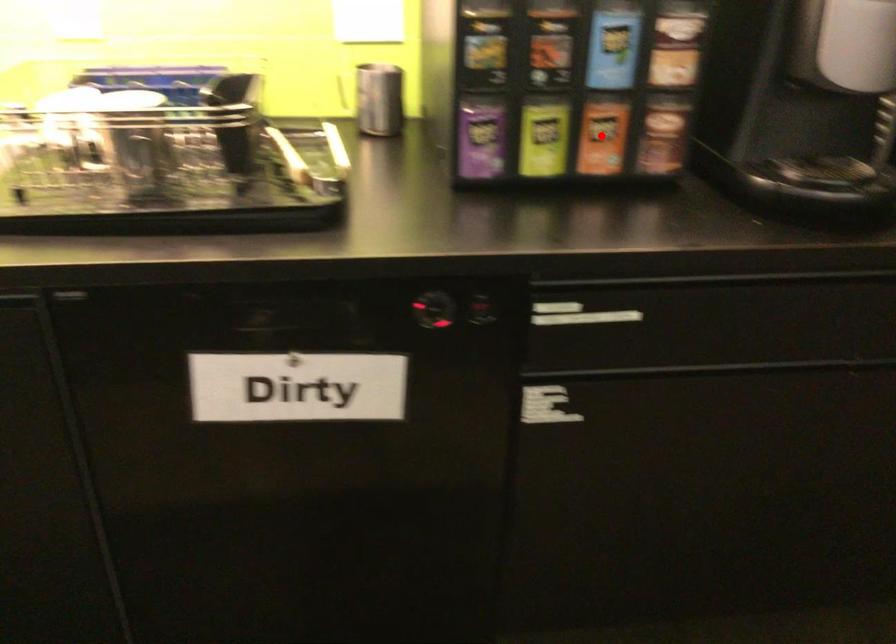
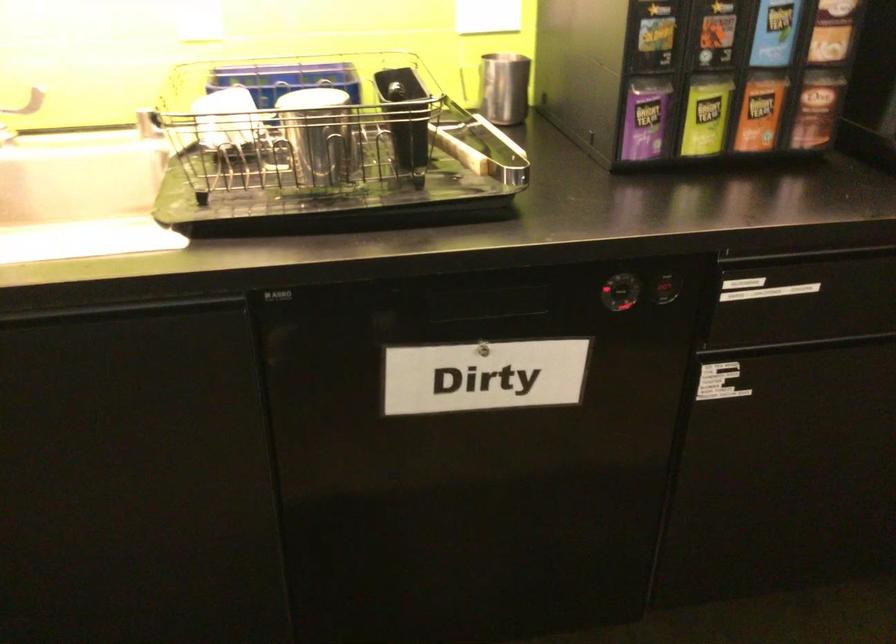
Find the pixel in the second image that matches the highlighted location in the first image.

(760, 111)